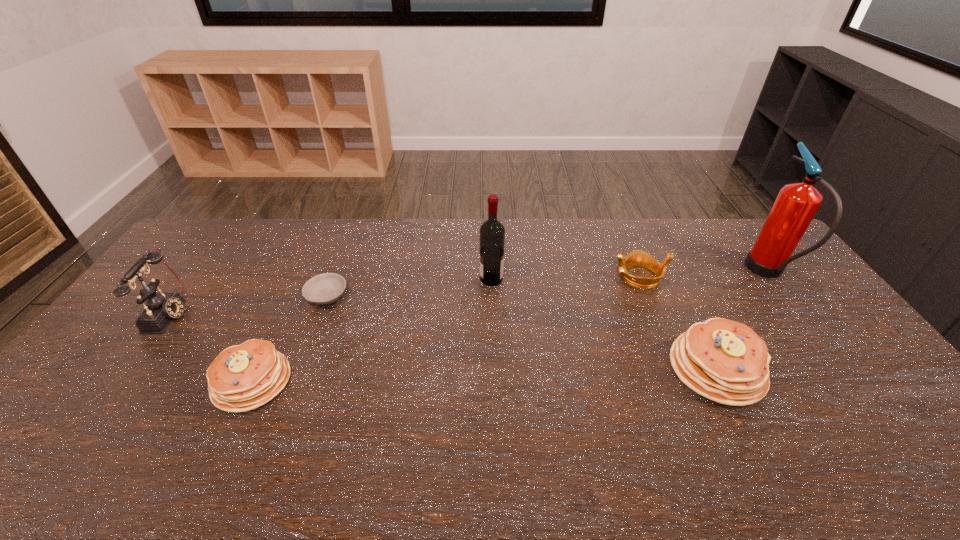
At what (x,y) coordinates should I click in order to perform the action: click on the shorter pancake. Please return your answer as a coordinate pair (x, y). Looking at the image, I should click on (244, 377).

At what (x,y) coordinates should I click in order to perform the action: click on the right pancake. Please return your answer as a coordinate pair (x, y). The image size is (960, 540). Looking at the image, I should click on (725, 361).

Locate an element on the screen. The image size is (960, 540). the fourth shortest object is located at coordinates (725, 361).

Locate an element on the screen. Image resolution: width=960 pixels, height=540 pixels. fire extinguisher is located at coordinates (796, 204).

The width and height of the screenshot is (960, 540). I want to click on the tallest object, so click(x=796, y=204).

Locate an element on the screen. The width and height of the screenshot is (960, 540). the leftmost object is located at coordinates (161, 308).

Where is `the third tallest object`? The width and height of the screenshot is (960, 540). the third tallest object is located at coordinates (161, 308).

Locate an element on the screen. The height and width of the screenshot is (540, 960). tiara is located at coordinates (640, 258).

This screenshot has height=540, width=960. I want to click on the shortest object, so click(326, 288).

The image size is (960, 540). I want to click on alcohol, so click(x=492, y=232).